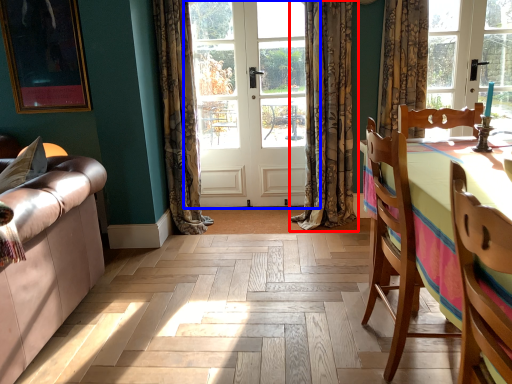
Question: Which object is closer to the camera taking this photo, curtain (highlighted by a red box) or door (highlighted by a blue box)?

Choices:
 (A) curtain
 (B) door

Answer: (A)